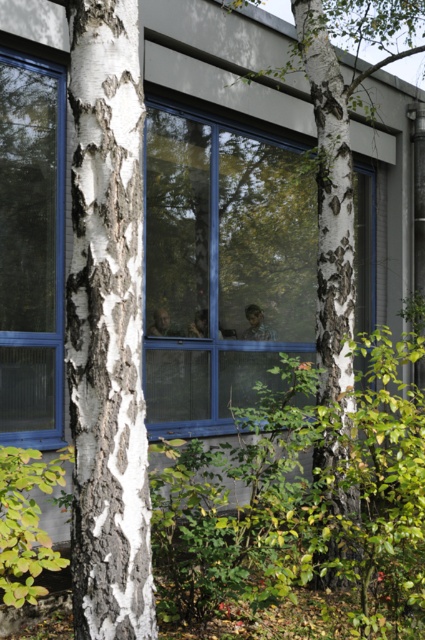
Can you confirm if white textured bark at center is positioned above white bark tree at center?

No.

Does white textured bark at center have a smaller size compared to white bark tree at center?

No, white textured bark at center is not smaller than white bark tree at center.

Is point (133, 465) positioned behind point (331, 99)?

No.

Image resolution: width=425 pixels, height=640 pixels. In order to click on white textured bark at center in this screenshot , I will do `click(107, 326)`.

Describe the element at coordinates (221, 268) in the screenshot. This screenshot has width=425, height=640. I see `blue glass window at center` at that location.

Is point (215, 177) positioned after point (19, 145)?

Yes, point (215, 177) is behind point (19, 145).

You are a GUI agent. You are given a task and a screenshot of the screen. Output one action in this format:
    pyautogui.click(x=<x>, y=<y>)
    Task: Click on the blue glass window at center
    The height and width of the screenshot is (640, 425).
    Given the screenshot: What is the action you would take?
    pyautogui.click(x=221, y=268)

Is point (152, 632) farther from viewer compared to point (10, 333)?

No, (152, 632) is in front of (10, 333).

Measure the distance between white textured bark at center and transparent glass window at left.

13.11 feet

Between point (138, 452) and point (31, 134), which one is positioned behind?

Positioned behind is point (31, 134).

I want to click on white textured bark at center, so click(x=107, y=326).